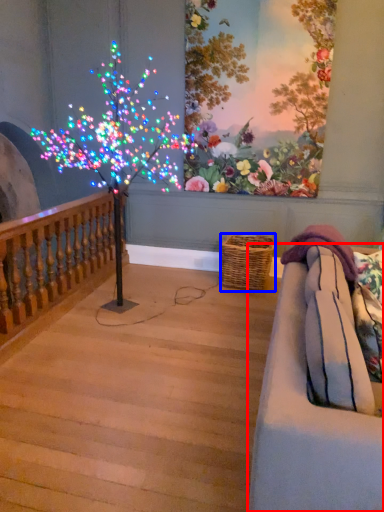
Question: Which point is closer to the camera, studio couch (highlighted by a red box) or basket (highlighted by a blue box)?

Choices:
 (A) studio couch
 (B) basket

Answer: (A)